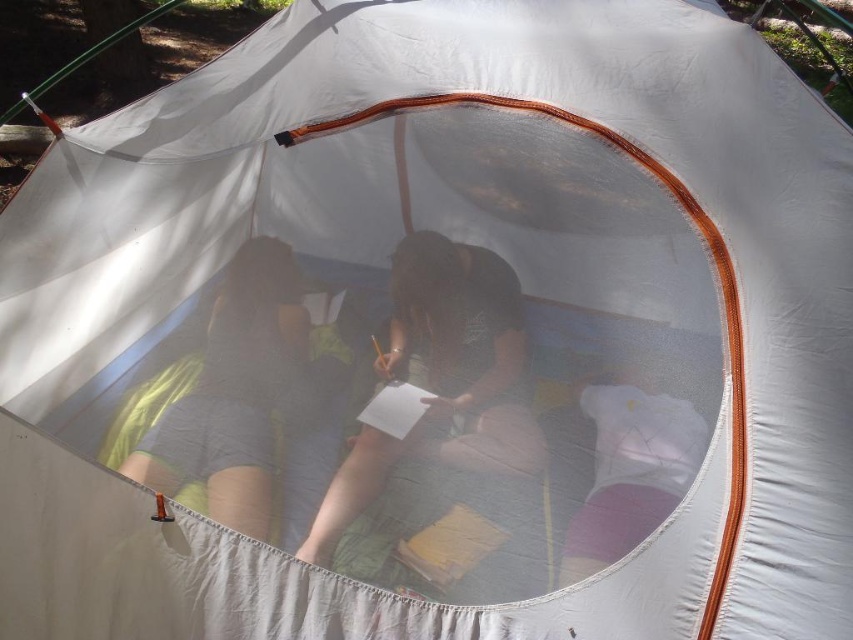
Between dark brown fabric at center and green fabric shorts at left, which one appears on the left side from the viewer's perspective?

Positioned to the left is green fabric shorts at left.

Is the position of dark brown fabric at center less distant than that of green fabric shorts at left?

Yes, it is in front of green fabric shorts at left.

Where is `dark brown fabric at center`? dark brown fabric at center is located at coordinates (442, 378).